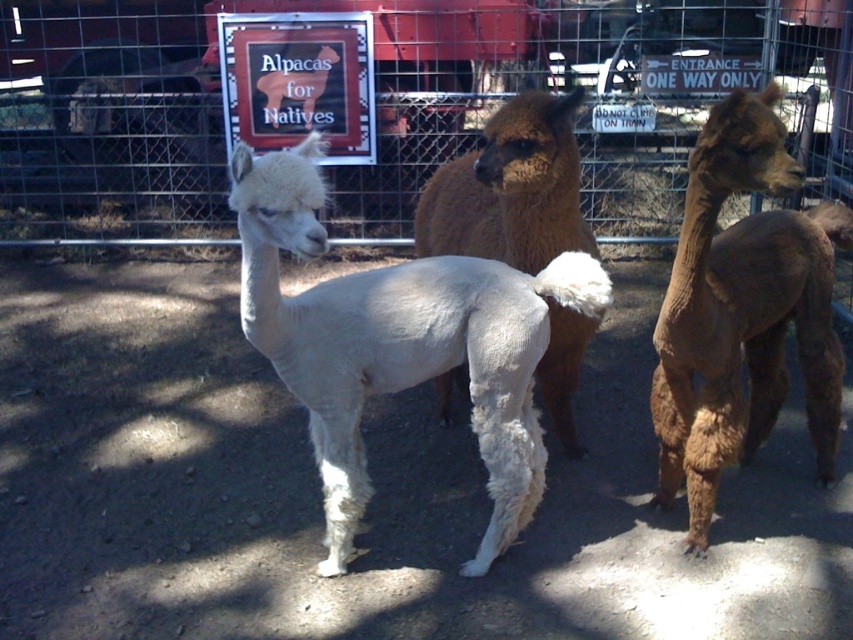
You are a farmer checking on your alpacas. You need to ensure that the metal wire fence at center is tall enough to keep the white fluffy alpaca at center from jumping out. Can you confirm if the fence is taller than the alpaca based on the scene?

The metal wire fence at center has a larger size compared to white fluffy alpaca at center, so the fence is likely taller than the alpaca and can prevent it from jumping out.

You are a farmer checking the enclosure. You notice the metal wire fence at center and the white fluffy alpaca at center. Which one has a greater width?

The metal wire fence at center is wider than the white fluffy alpaca at center according to the description.

You are a farmer checking the enclosure for space. The brown fuzzy alpaca at right and the brown fuzzy alpaca at center are both in the enclosure. Which alpaca takes up more horizontal space in the enclosure?

The brown fuzzy alpaca at right takes up more horizontal space in the enclosure because its width is larger than the brown fuzzy alpaca at center.